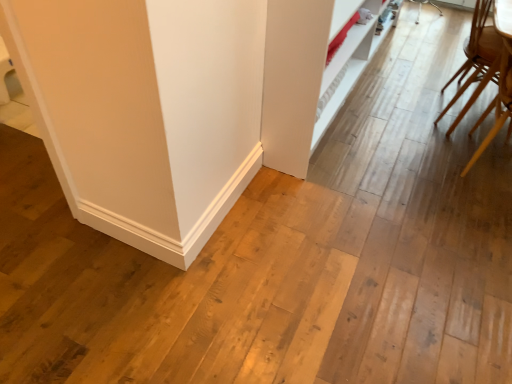
I want to click on vacant space in light brown wooden chair at right (from a real-world perspective), so click(x=474, y=122).